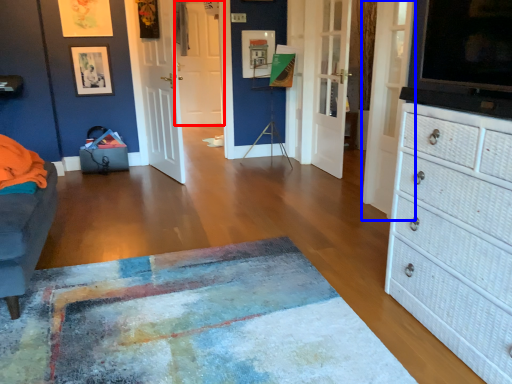
Question: Which object appears farthest to the camera in this image, door (highlighted by a red box) or door (highlighted by a blue box)?

Choices:
 (A) door
 (B) door

Answer: (A)